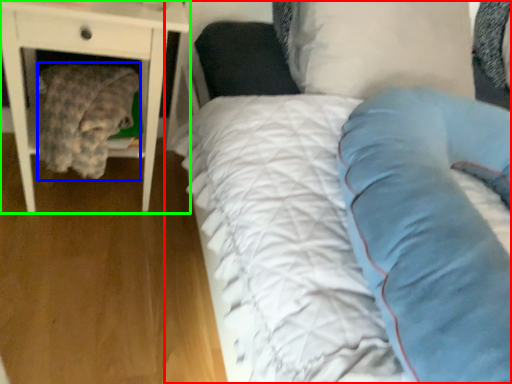
Question: Which object is the farthest from bed (highlighted by a red box)? Choose among these: material (highlighted by a blue box) or nightstand (highlighted by a green box).

Choices:
 (A) material
 (B) nightstand

Answer: (A)